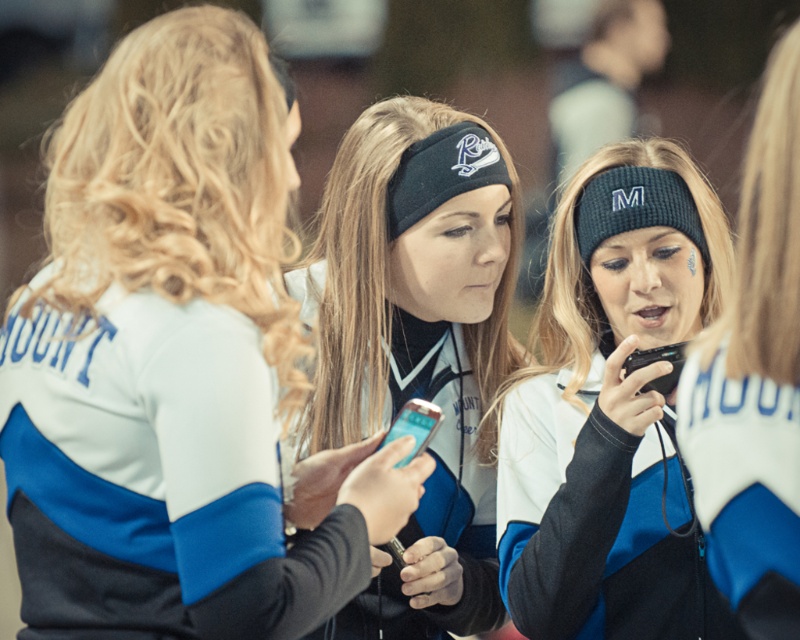
You are a photographer adjusting your camera settings to focus on the black knit beanie at center. The camera can only focus on objects within a 0.1 unit radius from the specified point. Is the black knit beanie at center within the focus range of point (612, 410)?

Yes, the black knit beanie at center is exactly at point (612, 410), so it is within the camera focus range of 0.1 unit radius.

You are a photographer at the sports event. You want to take a photo of the group of cheerleaders but need to ensure that the point at coordinates point (418, 337) is visible. Which object from the scene should you focus on to include this point?

The point at coordinates point (418, 337) is on the matte black headband at center, so focusing on the matte black headband at center will ensure this point is visible.

You are a photographer at a sports event. You see the matte black headband at center and the black plastic phone at center. Which object is closer to the left side of the image?

The matte black headband at center is to the left of the black plastic phone at center, so it is closer to the left side of the image.